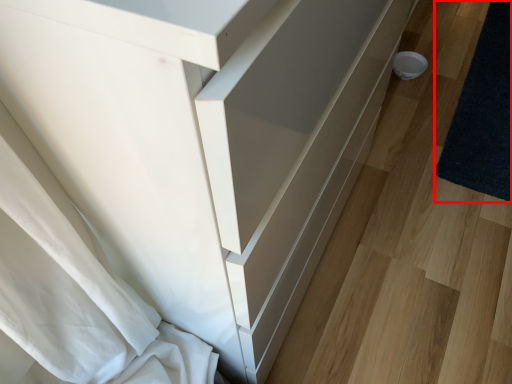
Question: From the image's perspective, where is mat (annotated by the red box) located relative to drawer?

Choices:
 (A) below
 (B) above

Answer: (B)